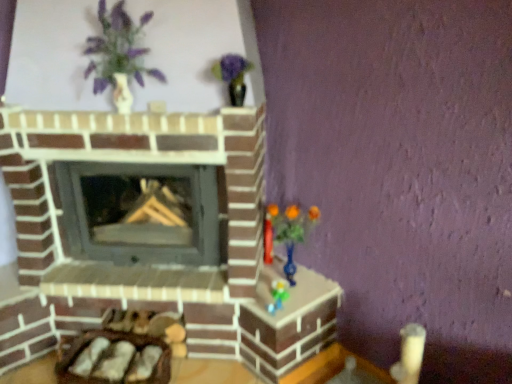
Find the location of a particular element. smooth gray wood burning stove at center is located at coordinates (137, 209).

From the picture: Measure the distance between translucent blue vase at right and camera.

A distance of 5.73 feet exists between translucent blue vase at right and camera.

This screenshot has height=384, width=512. I want to click on translucent blue vase at right, so tap(289, 231).

Identify the location of matte white vase at upper left. (117, 48).

Image resolution: width=512 pixels, height=384 pixels. I want to click on smooth gray wood burning stove at center, so click(x=137, y=209).

Is translucent blue vase at right taller or shorter than matte white vase at upper left?

In the image, translucent blue vase at right appears to be shorter than matte white vase at upper left.

At what (x,y) coordinates should I click in order to perform the action: click on floral arrangement located above the translucent blue vase at right (from a real-world perspective). Please return your answer as a coordinate pair (x, y). Looking at the image, I should click on (117, 48).

Which of these two, translucent blue vase at right or matte white vase at upper left, is bigger?

matte white vase at upper left is bigger.

What's the angular difference between translucent blue vase at right and matte white vase at upper left's facing directions?

There is a 4.11-degree angle between the facing directions of translucent blue vase at right and matte white vase at upper left.

Consider the image. In terms of height, does matte white vase at upper left look taller or shorter compared to translucent blue vase at right?

Clearly, matte white vase at upper left is taller compared to translucent blue vase at right.

Which of these two, matte white vase at upper left or translucent blue vase at right, is bigger?

matte white vase at upper left.

How far apart are matte white vase at upper left and translucent blue vase at right?

They are 87.52 centimeters apart.

How different are the orientations of matte white vase at upper left and translucent blue vase at right in degrees?

matte white vase at upper left and translucent blue vase at right are facing 4.11 degrees away from each other.

Is smooth gray wood burning stove at center in front of matte white vase at upper left?

No, it is behind matte white vase at upper left.

From the image's perspective, is smooth gray wood burning stove at center located above matte white vase at upper left?

No, from the image's perspective, smooth gray wood burning stove at center is not over matte white vase at upper left.

From a real-world perspective, is smooth gray wood burning stove at center positioned under matte white vase at upper left based on gravity?

Correct, in the physical world, smooth gray wood burning stove at center is lower than matte white vase at upper left.

Who is taller, smooth gray wood burning stove at center or matte white vase at upper left?

Standing taller between the two is smooth gray wood burning stove at center.

Is translucent blue vase at right touching smooth gray wood burning stove at center?

There is a gap between translucent blue vase at right and smooth gray wood burning stove at center.

From a real-world perspective, who is located higher, translucent blue vase at right or smooth gray wood burning stove at center?

smooth gray wood burning stove at center is physically above.

Consider the image. Can smooth gray wood burning stove at center be found inside translucent blue vase at right?

Definitely not — smooth gray wood burning stove at center is not inside translucent blue vase at right.

Who is shorter, translucent blue vase at right or smooth gray wood burning stove at center?

translucent blue vase at right.

Who is bigger, smooth gray wood burning stove at center or translucent blue vase at right?

smooth gray wood burning stove at center.

Considering the relative sizes of smooth gray wood burning stove at center and translucent blue vase at right in the image provided, is smooth gray wood burning stove at center shorter than translucent blue vase at right?

No.

Between smooth gray wood burning stove at center and translucent blue vase at right, which one appears on the left side from the viewer's perspective?

Positioned to the left is smooth gray wood burning stove at center.

Considering the relative sizes of matte white vase at upper left and smooth gray wood burning stove at center in the image provided, is matte white vase at upper left bigger than smooth gray wood burning stove at center?

No, matte white vase at upper left is not bigger than smooth gray wood burning stove at center.

Is matte white vase at upper left oriented away from smooth gray wood burning stove at center?

No, matte white vase at upper left is not facing the opposite direction of smooth gray wood burning stove at center.

Between matte white vase at upper left and smooth gray wood burning stove at center, which one appears on the right side from the viewer's perspective?

matte white vase at upper left is more to the right.

Are matte white vase at upper left and smooth gray wood burning stove at center making contact?

matte white vase at upper left and smooth gray wood burning stove at center are not in contact.

Where is `toy located underneath the matte white vase at upper left (from a real-world perspective)`? The image size is (512, 384). toy located underneath the matte white vase at upper left (from a real-world perspective) is located at coordinates (289, 231).

Where is `floral arrangement above the translucent blue vase at right (from the image's perspective)`? This screenshot has height=384, width=512. floral arrangement above the translucent blue vase at right (from the image's perspective) is located at coordinates (117, 48).

When comparing their distances from translucent blue vase at right, does smooth gray wood burning stove at center or matte white vase at upper left seem further?

matte white vase at upper left is further to translucent blue vase at right.

When comparing their distances from matte white vase at upper left, does translucent blue vase at right or smooth gray wood burning stove at center seem further?

translucent blue vase at right is positioned further to the anchor matte white vase at upper left.

Which object lies further to the anchor point smooth gray wood burning stove at center, translucent blue vase at right or matte white vase at upper left?

Based on the image, matte white vase at upper left appears to be further to smooth gray wood burning stove at center.

Estimate the real-world distances between objects in this image. Which object is further from translucent blue vase at right, matte white vase at upper left or smooth gray wood burning stove at center?

matte white vase at upper left.

From the image, which object appears to be farther from smooth gray wood burning stove at center, matte white vase at upper left or translucent blue vase at right?

matte white vase at upper left.

Looking at the image, which one is located closer to matte white vase at upper left, smooth gray wood burning stove at center or translucent blue vase at right?

Among the two, smooth gray wood burning stove at center is located nearer to matte white vase at upper left.

You are a GUI agent. You are given a task and a screenshot of the screen. Output one action in this format:
    pyautogui.click(x=<x>, y=<y>)
    Task: Click on the wood burning stove between matte white vase at upper left and translucent blue vase at right vertically
    Image resolution: width=512 pixels, height=384 pixels.
    Given the screenshot: What is the action you would take?
    pyautogui.click(x=137, y=209)